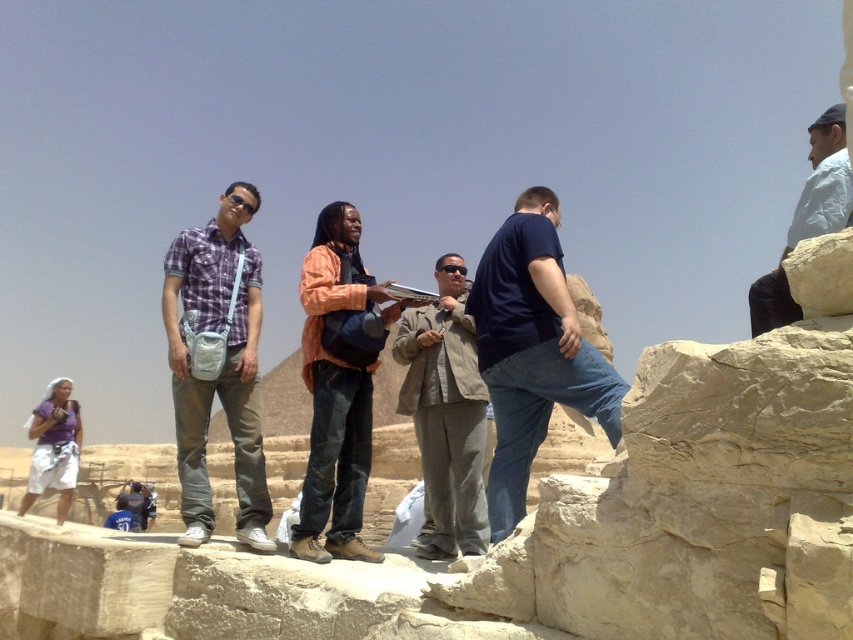
Question: Does plaid cotton shirt at center have a greater width compared to purple fabric bag at lower left?

Choices:
 (A) no
 (B) yes

Answer: (A)

Question: Which point is farther to the camera?

Choices:
 (A) (230, 365)
 (B) (572, 304)
 (C) (326, 349)
 (D) (811, 128)

Answer: (D)

Question: Which point appears farthest from the camera in this image?

Choices:
 (A) (495, 288)
 (B) (315, 348)

Answer: (B)

Question: Which of these objects is positioned farthest from the orange cotton shirt at center?

Choices:
 (A) purple fabric bag at lower left
 (B) dark blue denim jeans at center
 (C) white cotton shirt at upper right

Answer: (A)

Question: Does dark blue denim jeans at center come in front of purple fabric bag at lower left?

Choices:
 (A) yes
 (B) no

Answer: (A)

Question: Where is orange cotton shirt at center located in relation to gray matte jacket at center in the image?

Choices:
 (A) below
 (B) above

Answer: (A)